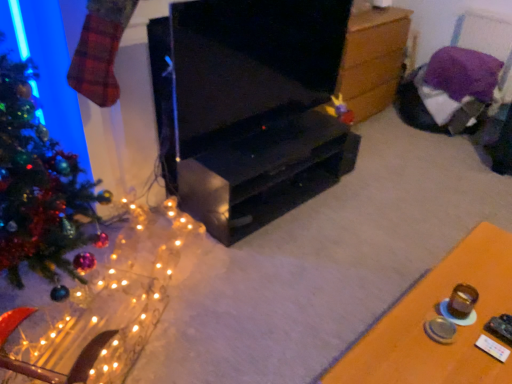
The height and width of the screenshot is (384, 512). Describe the element at coordinates (39, 189) in the screenshot. I see `shiny green christmas tree at left` at that location.

Measure the distance between wooden chest at center, acting as the 1th table starting from the back, and camera.

wooden chest at center, acting as the 1th table starting from the back, and camera are 8.82 feet apart from each other.

Where is `black glossy tv stand at center`? black glossy tv stand at center is located at coordinates (249, 107).

Locate an element on the screen. This screenshot has height=384, width=512. purple fabric chair at upper right is located at coordinates pyautogui.click(x=460, y=78).

The width and height of the screenshot is (512, 384). What are the coordinates of `shiny green christmas tree at left` in the screenshot? It's located at (39, 189).

Is black glossy tv stand at center next to purple fabric chair at upper right and touching it?

black glossy tv stand at center and purple fabric chair at upper right are clearly separated.

Considering the sizes of objects black glossy tv stand at center and purple fabric chair at upper right in the image provided, who is taller, black glossy tv stand at center or purple fabric chair at upper right?

Standing taller between the two is black glossy tv stand at center.

From the image's perspective, is black glossy tv stand at center beneath purple fabric chair at upper right?

Yes, from the image's perspective, black glossy tv stand at center is below purple fabric chair at upper right.

Based on their sizes in the image, would you say black matte tv cabinet at center is bigger or smaller than wooden table at lower right, the 1th table when ordered from front to back?

Considering their sizes, black matte tv cabinet at center takes up less space than wooden table at lower right, the 1th table when ordered from front to back.

Does black matte tv cabinet at center turn towards wooden table at lower right, the 2th table in the back-to-front sequence?

Yes, black matte tv cabinet at center is turned towards wooden table at lower right, the 2th table in the back-to-front sequence.

Based on the photo, which is nearer, [184,164] or [370,340]?

The point [370,340] is closer to the camera.

Is black matte tv cabinet at center taller or shorter than wooden table at lower right, the 1th table when ordered from front to back?

black matte tv cabinet at center is shorter than wooden table at lower right, the 1th table when ordered from front to back.

Is black matte tv cabinet at center positioned beyond the bounds of shiny green christmas tree at left?

Yes, black matte tv cabinet at center is located beyond the bounds of shiny green christmas tree at left.

From a real-world perspective, is black matte tv cabinet at center under shiny green christmas tree at left?

Yes.

Is black matte tv cabinet at center taller than shiny green christmas tree at left?

In fact, black matte tv cabinet at center may be shorter than shiny green christmas tree at left.

From the image's perspective, does black matte tv cabinet at center appear higher than shiny green christmas tree at left?

Incorrect, from the image's perspective, black matte tv cabinet at center is lower than shiny green christmas tree at left.

Can you tell me how much purple fabric chair at upper right and illuminated wire mesh at left differ in facing direction?

There is a 118-degree angle between the facing directions of purple fabric chair at upper right and illuminated wire mesh at left.

From a real-world perspective, is purple fabric chair at upper right above or below illuminated wire mesh at left?

From a real-world perspective, purple fabric chair at upper right is physically above illuminated wire mesh at left.

In the scene shown: Is purple fabric chair at upper right bigger than illuminated wire mesh at left?

No.

How distant is purple fabric chair at upper right from illuminated wire mesh at left?

purple fabric chair at upper right is 7.82 feet from illuminated wire mesh at left.

I want to click on table that is above the wooden table at lower right, the 2th table in the back-to-front sequence (from a real-world perspective), so click(x=373, y=59).

Considering the relative sizes of wooden chest at center, which is the second table from bottom to top, and wooden table at lower right, placed as the 1th table when sorted from bottom to top, in the image provided, is wooden chest at center, which is the second table from bottom to top, smaller than wooden table at lower right, placed as the 1th table when sorted from bottom to top,?

No.

Between point (360, 102) and point (422, 310), which one is positioned behind?

Positioned behind is point (360, 102).

Could you tell me if wooden chest at center, which ranks as the first table in top-to-bottom order, is turned towards wooden table at lower right, placed as the 1th table when sorted from bottom to top?

No.

From the image's perspective, is wooden table at lower right, the 1th table when ordered from front to back, over black matte tv cabinet at center?

Incorrect, from the image's perspective, wooden table at lower right, the 1th table when ordered from front to back, is lower than black matte tv cabinet at center.

How different are the orientations of wooden table at lower right, placed as the second table when sorted from top to bottom, and black matte tv cabinet at center in degrees?

The facing directions of wooden table at lower right, placed as the second table when sorted from top to bottom, and black matte tv cabinet at center are 180 degrees apart.

Based on their positions, is wooden table at lower right, placed as the 1th table when sorted from bottom to top, located to the left or right of black matte tv cabinet at center?

Based on their positions, wooden table at lower right, placed as the 1th table when sorted from bottom to top, is located to the right of black matte tv cabinet at center.

Does wooden table at lower right, placed as the 1th table when sorted from bottom to top, have a greater height compared to black matte tv cabinet at center?

Yes.

In the image, is black matte tv cabinet at center positioned in front of or behind purple fabric chair at upper right?

black matte tv cabinet at center is positioned closer to the viewer than purple fabric chair at upper right.

Considering the positions of objects black matte tv cabinet at center and purple fabric chair at upper right in the image provided, who is more to the right, black matte tv cabinet at center or purple fabric chair at upper right?

purple fabric chair at upper right.

Is black matte tv cabinet at center aimed at purple fabric chair at upper right?

No, black matte tv cabinet at center is not turned towards purple fabric chair at upper right.

Is black matte tv cabinet at center not near purple fabric chair at upper right?

black matte tv cabinet at center is positioned a significant distance from purple fabric chair at upper right.

Locate an element on the screen. This screenshot has width=512, height=384. furniture below the purple fabric chair at upper right (from the image's perspective) is located at coordinates (249, 107).

Where is `tv cabinet that is above the wooden table at lower right, placed as the second table when sorted from top to bottom (from a real-world perspective)`? The image size is (512, 384). tv cabinet that is above the wooden table at lower right, placed as the second table when sorted from top to bottom (from a real-world perspective) is located at coordinates (265, 173).

When comparing their distances from illuminated wire mesh at left, does black glossy tv stand at center or wooden table at lower right, the 2th table in the back-to-front sequence, seem closer?

black glossy tv stand at center is closer to illuminated wire mesh at left.

Looking at the image, which one is located closer to wooden chest at center, acting as the 1th table starting from the back, purple fabric chair at upper right or illuminated wire mesh at left?

purple fabric chair at upper right lies closer to wooden chest at center, acting as the 1th table starting from the back, than the other object.

When comparing their distances from wooden chest at center, which ranks as the first table in top-to-bottom order, does wooden table at lower right, placed as the second table when sorted from top to bottom, or illuminated wire mesh at left seem closer?

wooden table at lower right, placed as the second table when sorted from top to bottom, lies closer to wooden chest at center, which ranks as the first table in top-to-bottom order, than the other object.

When comparing their distances from illuminated wire mesh at left, does wooden chest at center, which is the second table from bottom to top, or purple fabric chair at upper right seem further?

purple fabric chair at upper right lies further to illuminated wire mesh at left than the other object.

Estimate the real-world distances between objects in this image. Which object is closer to wooden chest at center, which is the second table from bottom to top, illuminated wire mesh at left or black glossy tv stand at center?

black glossy tv stand at center is positioned closer to the anchor wooden chest at center, which is the second table from bottom to top.

Estimate the real-world distances between objects in this image. Which object is further from black matte tv cabinet at center, purple fabric chair at upper right or black glossy tv stand at center?

purple fabric chair at upper right is positioned further to the anchor black matte tv cabinet at center.

Considering their positions, is shiny green christmas tree at left positioned further to purple fabric chair at upper right than black glossy tv stand at center?

shiny green christmas tree at left is positioned further to the anchor purple fabric chair at upper right.

Based on the photo, from the image, which object appears to be nearer to purple fabric chair at upper right, shiny green christmas tree at left or black matte tv cabinet at center?

black matte tv cabinet at center is positioned closer to the anchor purple fabric chair at upper right.

This screenshot has width=512, height=384. Find the location of `christmas decoration between shiny green christmas tree at left and black matte tv cabinet at center`. christmas decoration between shiny green christmas tree at left and black matte tv cabinet at center is located at coordinates (101, 308).

You are a GUI agent. You are given a task and a screenshot of the screen. Output one action in this format:
    pyautogui.click(x=<x>, y=<y>)
    Task: Click on the tv cabinet between illuminated wire mesh at left and wooden table at lower right, placed as the 1th table when sorted from bottom to top, from left to right
    
    Given the screenshot: What is the action you would take?
    click(x=265, y=173)

At what (x,y) coordinates should I click in order to perform the action: click on tv cabinet between shiny green christmas tree at left and wooden chest at center, which is the second table from bottom to top. Please return your answer as a coordinate pair (x, y). This screenshot has height=384, width=512. Looking at the image, I should click on (265, 173).

At what (x,y) coordinates should I click in order to perform the action: click on furniture between shiny green christmas tree at left and wooden table at lower right, the 2th table in the back-to-front sequence, in the horizontal direction. Please return your answer as a coordinate pair (x, y). The width and height of the screenshot is (512, 384). Looking at the image, I should click on (249, 107).